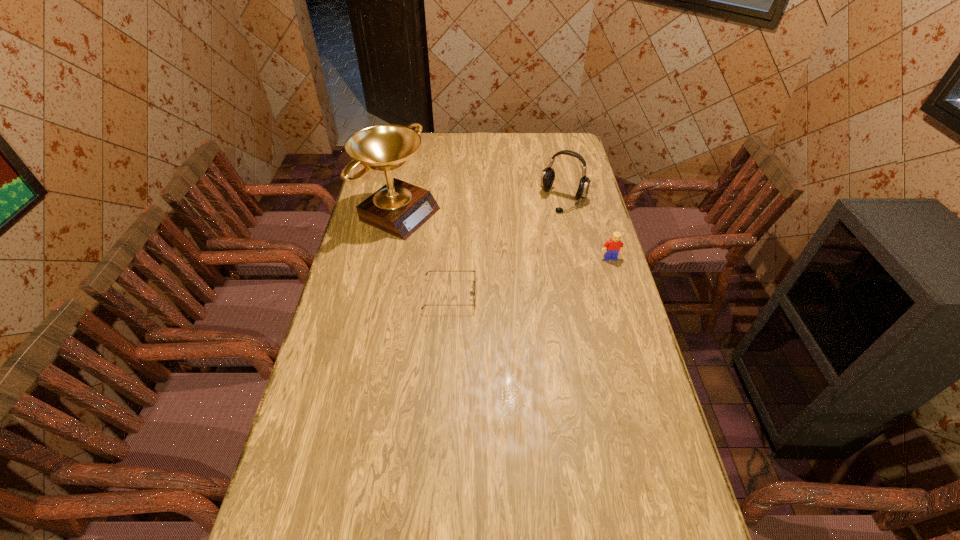
Identify the location of sunglasses. (471, 293).

Find the location of a particular element. the nearest object is located at coordinates (471, 293).

Identify the location of the second shortest object. Image resolution: width=960 pixels, height=540 pixels. (614, 245).

This screenshot has height=540, width=960. I want to click on the second nearest object, so click(614, 245).

This screenshot has height=540, width=960. What are the coordinates of `headset` in the screenshot? It's located at (548, 175).

Find the location of a particular element. The height and width of the screenshot is (540, 960). award is located at coordinates (399, 208).

This screenshot has width=960, height=540. In order to click on free region located 0.320m on the front-facing side of the shortest object in this screenshot , I will do point(573,295).

Where is `vacant space located on the face of the second nearest object`? vacant space located on the face of the second nearest object is located at coordinates (632, 329).

In order to click on free spot located with the microphone on the side of the headset in this screenshot , I will do `click(521, 273)`.

You are a GUI agent. You are given a task and a screenshot of the screen. Output one action in this format:
    pyautogui.click(x=<x>, y=<y>)
    Task: Click on the vacant space located 0.260m with the microphone on the side of the headset
    The height and width of the screenshot is (540, 960).
    Given the screenshot: What is the action you would take?
    [x=533, y=253]